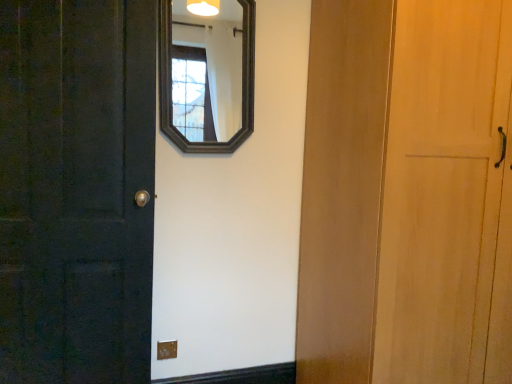
Question: From a real-world perspective, is matte brown outlet at lower center physically located above or below matte black door at left?

Choices:
 (A) below
 (B) above

Answer: (A)

Question: Is matte brown outlet at lower center wider or thinner than matte black door at left?

Choices:
 (A) wide
 (B) thin

Answer: (B)

Question: Which is nearer to the dark wood mirror at upper center?

Choices:
 (A) matte brown outlet at lower center
 (B) matte black door at left

Answer: (B)

Question: Estimate the real-world distances between objects in this image. Which object is closer to the matte black door at left?

Choices:
 (A) matte brown outlet at lower center
 (B) dark wood mirror at upper center

Answer: (A)